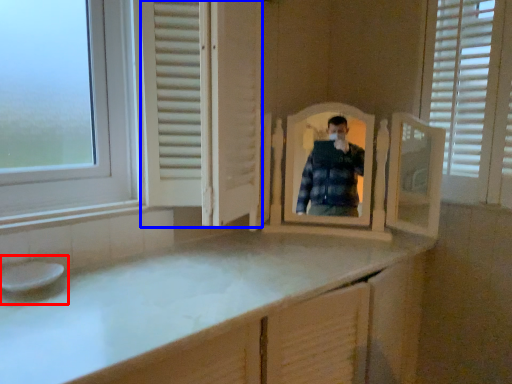
Question: Which object appears closest to the camera in this image, sink (highlighted by a red box) or screen door (highlighted by a blue box)?

Choices:
 (A) sink
 (B) screen door

Answer: (B)